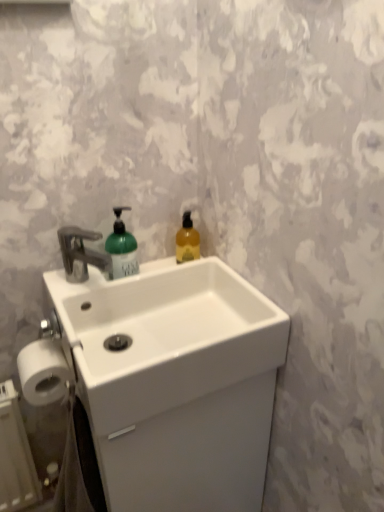
Question: Is point (185, 258) closer or farther from the camera than point (112, 242)?

Choices:
 (A) closer
 (B) farther

Answer: (B)

Question: Considering their positions, is translucent amber liquid at upper right, acting as the 2th bottle starting from the left, located in front of or behind green matte bottle at center, the first bottle viewed from the left?

Choices:
 (A) behind
 (B) front

Answer: (A)

Question: Which is nearer to the translucent amber liquid at upper right, the first bottle in the right-to-left sequence?

Choices:
 (A) green matte bottle at center, arranged as the 2th bottle when viewed from the right
 (B) white matte toilet paper at lower left
 (C) white ceramic sink at center

Answer: (A)

Question: Which object is the closest to the white ceramic sink at center?

Choices:
 (A) green matte bottle at center, the first bottle viewed from the left
 (B) translucent amber liquid at upper right, the first bottle in the right-to-left sequence
 (C) white matte toilet paper at lower left

Answer: (A)